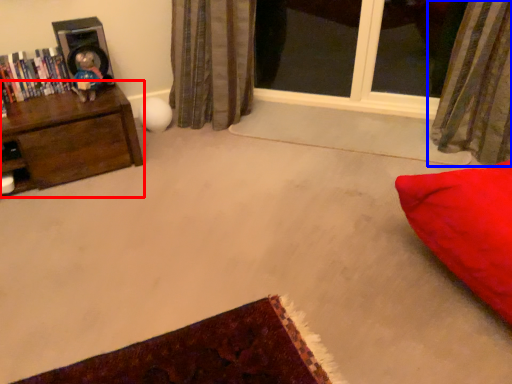
Question: Which of the following is the farthest to the observer, furniture (highlighted by a red box) or curtain (highlighted by a blue box)?

Choices:
 (A) furniture
 (B) curtain

Answer: (A)